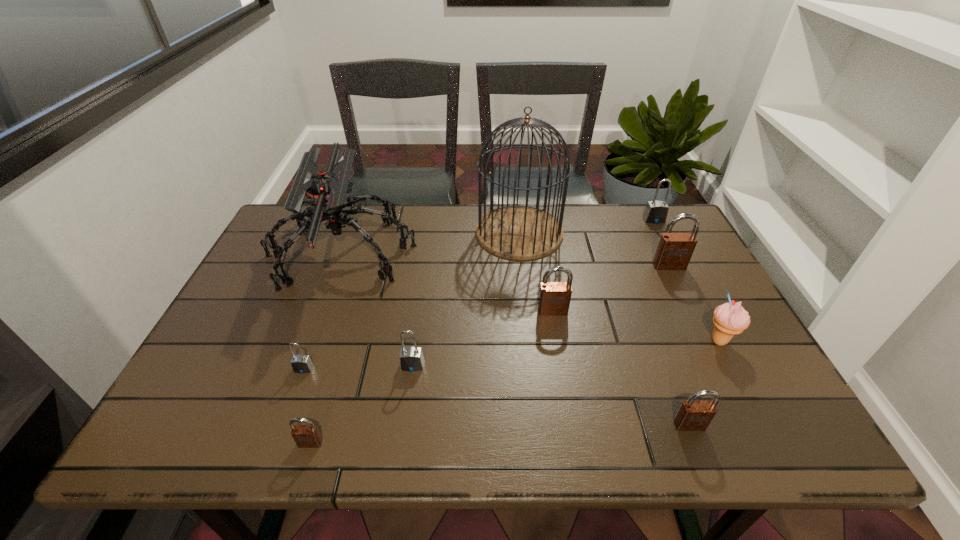
At what (x,y) coordinates should I click in order to perform the action: click on unoccupied area between the leftmost gray padlock and the third farthest padlock. Please return your answer as a coordinate pair (x, y). The width and height of the screenshot is (960, 540). Looking at the image, I should click on (428, 340).

Find the location of `object that is the sixth nearest to the black drone`. object that is the sixth nearest to the black drone is located at coordinates (692, 415).

Identify which object is located as the ninth nearest to the rightmost brown padlock. Please provide its 2D coordinates. Your answer should be formatted as a tuple, i.e. [(x, y)], where the tuple contains the x and y coordinates of a point satisfying the conditions above.

[(305, 436)]

This screenshot has width=960, height=540. What are the coordinates of `the fifth closest padlock to the birdcage` in the screenshot? It's located at (302, 363).

Find the location of a particular element. The image size is (960, 540). padlock that stands as the second closest to the second gray padlock from left to right is located at coordinates (305, 436).

Locate an element on the screen. brown padlock that is the fourth closest one to the leftmost gray padlock is located at coordinates (674, 251).

Locate an element on the screen. The image size is (960, 540). brown padlock that is the closest one to the smallest gray padlock is located at coordinates (305, 436).

Select which gray padlock is the second closest to the second gray padlock from left to right. Please provide its 2D coordinates. Your answer should be formatted as a tuple, i.e. [(x, y)], where the tuple contains the x and y coordinates of a point satisfying the conditions above.

[(655, 212)]

You are a GUI agent. You are given a task and a screenshot of the screen. Output one action in this format:
    pyautogui.click(x=<x>, y=<y>)
    Task: Click on the gray padlock identified as the third closest to the icecream
    
    Given the screenshot: What is the action you would take?
    pyautogui.click(x=302, y=363)

Locate an element on the screen. free space that satisfies the following two spatial constraints: 1. at the door of the icecream; 2. on the right side of the tallest object is located at coordinates click(x=532, y=341).